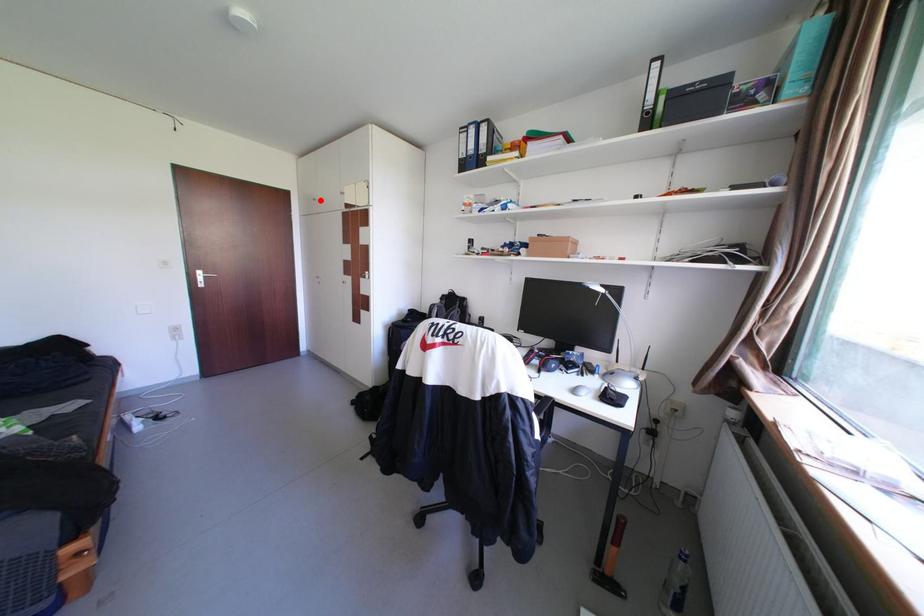
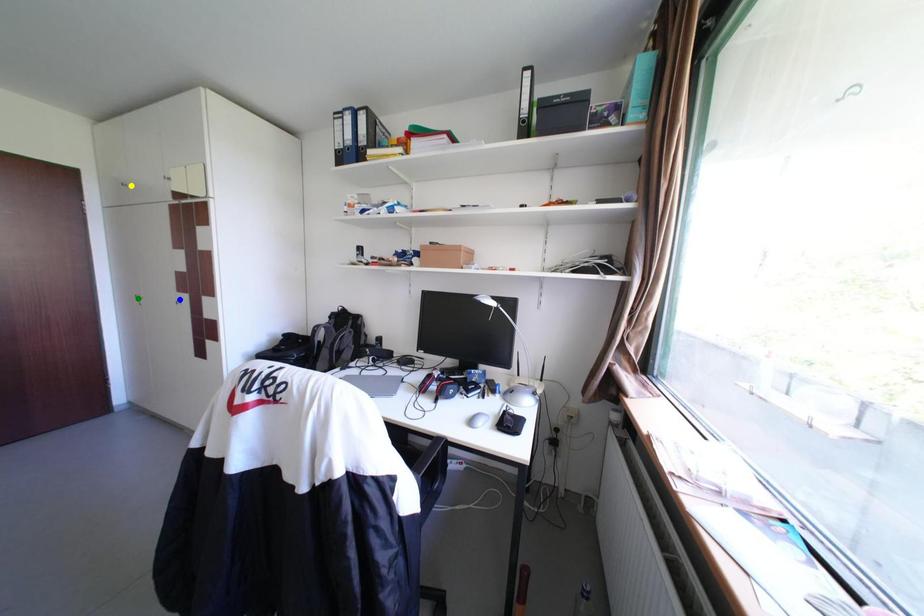
Question: I am providing you with two images of the same scene from different viewpoints. A red point is marked on the first image. You are given multiple points on the second image. In image 2, which mark is for the same physical point as the one in image 1?

Choices:
 (A) yellow point
 (B) blue point
 (C) green point

Answer: (A)